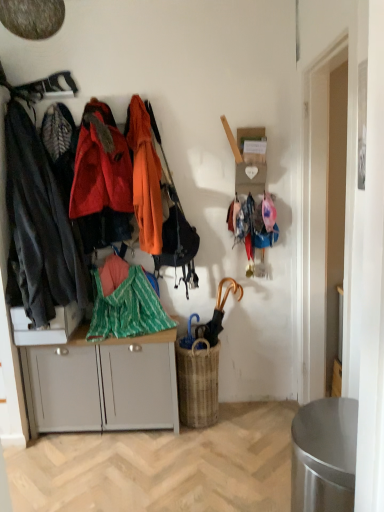
Question: Is gold metallic umbrella at center-right to the left or to the right of white matte cabinet at center in the image?

Choices:
 (A) left
 (B) right

Answer: (B)

Question: From the image's perspective, is gold metallic umbrella at center-right located above or below white matte cabinet at center?

Choices:
 (A) above
 (B) below

Answer: (A)

Question: Which is farther from the woven brown picnic basket at center?

Choices:
 (A) white glossy cabinet at lower left
 (B) gold metallic umbrella at center-right
 (C) green striped fabric at center
 (D) matte black jacket at left, positioned as the 1th clothing in left-to-right order
 (E) orange fabric coat at center, which appears as the 1th clothing when viewed from the right

Answer: (D)

Question: Which object is positioned farthest from the orange matte jacket at left, which appears as the 2th clothing when viewed from the left?

Choices:
 (A) green striped fabric at center
 (B) matte black jacket at left, positioned as the 1th clothing in left-to-right order
 (C) woven brown picnic basket at center
 (D) white matte cabinet at center
 (E) gold metallic umbrella at center-right

Answer: (C)